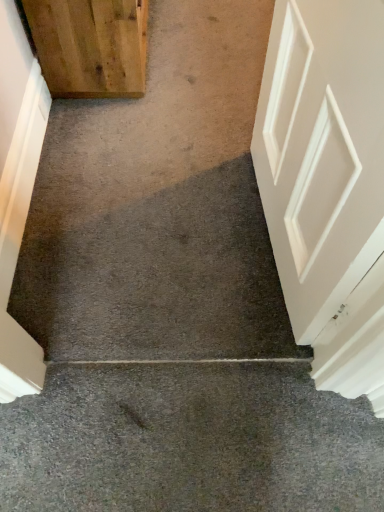
Question: Is wooden door at upper left, which appears as the first door when viewed from the top, aimed at white matte door at left, the second door in the top-to-bottom sequence?

Choices:
 (A) no
 (B) yes

Answer: (A)

Question: Is wooden door at upper left, which appears as the first door when viewed from the top, bigger than white matte door at left, the second door in the top-to-bottom sequence?

Choices:
 (A) no
 (B) yes

Answer: (B)

Question: Does wooden door at upper left, the second door positioned from the bottom, have a greater width compared to white matte door at left, the second door in the top-to-bottom sequence?

Choices:
 (A) no
 (B) yes

Answer: (B)

Question: From a real-world perspective, is wooden door at upper left, which appears as the first door when viewed from the top, on top of white matte door at left, positioned as the first door in bottom-to-top order?

Choices:
 (A) no
 (B) yes

Answer: (B)

Question: From a real-world perspective, is wooden door at upper left, the second door positioned from the bottom, located beneath white matte door at left, the second door in the top-to-bottom sequence?

Choices:
 (A) no
 (B) yes

Answer: (A)

Question: Can you confirm if wooden door at upper left, the second door positioned from the bottom, is smaller than white matte door at left, positioned as the first door in bottom-to-top order?

Choices:
 (A) no
 (B) yes

Answer: (A)

Question: Would you say gray carpet at center is part of white matte door at left, positioned as the first door in bottom-to-top order,'s contents?

Choices:
 (A) yes
 (B) no

Answer: (B)

Question: Does white matte door at left, the second door in the top-to-bottom sequence, have a greater width compared to gray carpet at center?

Choices:
 (A) yes
 (B) no

Answer: (B)

Question: Is white matte door at left, the second door in the top-to-bottom sequence, not inside gray carpet at center?

Choices:
 (A) yes
 (B) no

Answer: (A)

Question: From the image's perspective, is white matte door at left, positioned as the first door in bottom-to-top order, located beneath gray carpet at center?

Choices:
 (A) yes
 (B) no

Answer: (B)

Question: Can you confirm if white matte door at left, the second door in the top-to-bottom sequence, is thinner than gray carpet at center?

Choices:
 (A) no
 (B) yes

Answer: (B)

Question: Is white matte door at left, the second door in the top-to-bottom sequence, positioned with its back to gray carpet at center?

Choices:
 (A) no
 (B) yes

Answer: (A)

Question: From a real-world perspective, is gray carpet at center located higher than white matte door at left, the second door in the top-to-bottom sequence?

Choices:
 (A) yes
 (B) no

Answer: (B)